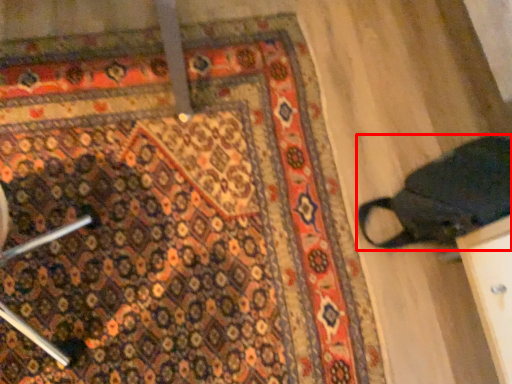
Question: Considering the relative positions of footwear (annotated by the red box) and mat in the image provided, where is footwear (annotated by the red box) located with respect to the staircase?

Choices:
 (A) right
 (B) left

Answer: (A)